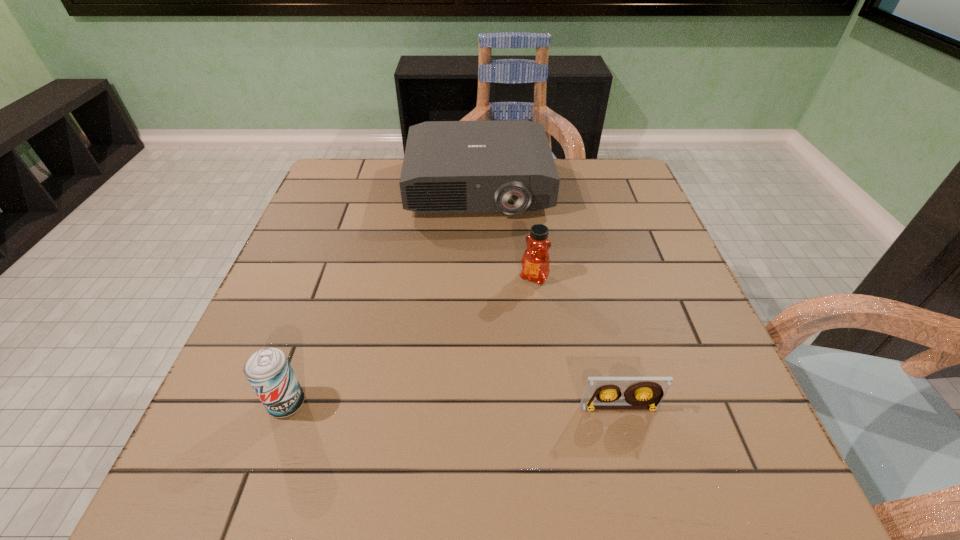
I want to click on unoccupied area between the videotape and the farthest object, so click(549, 297).

The image size is (960, 540). In order to click on free space that is in between the honey and the leftmost object in this screenshot , I will do 411,340.

What are the coordinates of `free spot between the honey and the videotape` in the screenshot? It's located at (577, 342).

Select which object is the closest to the projector. Please provide its 2D coordinates. Your answer should be formatted as a tuple, i.e. [(x, y)], where the tuple contains the x and y coordinates of a point satisfying the conditions above.

[(535, 262)]

Locate an element on the screen. the second closest object relative to the farthest object is located at coordinates (268, 371).